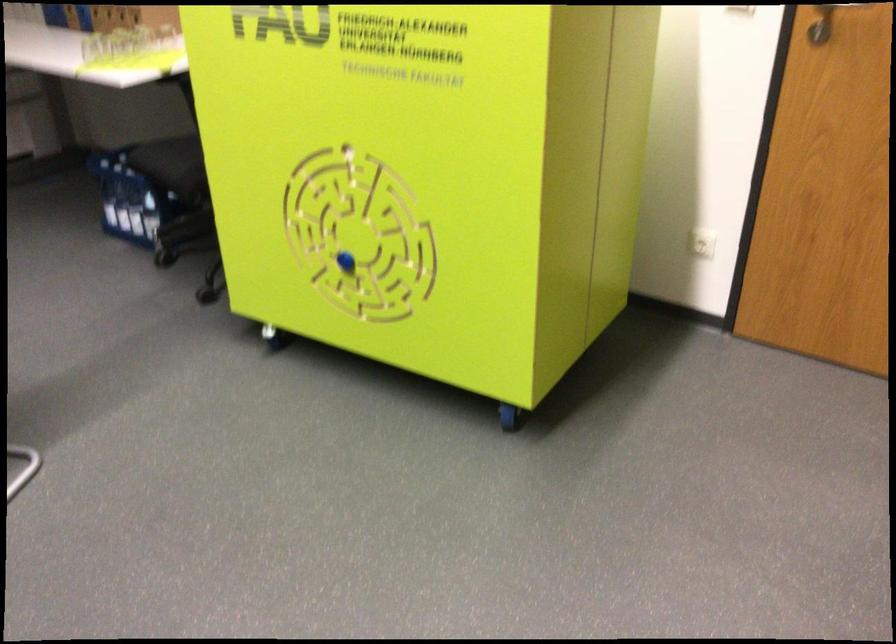
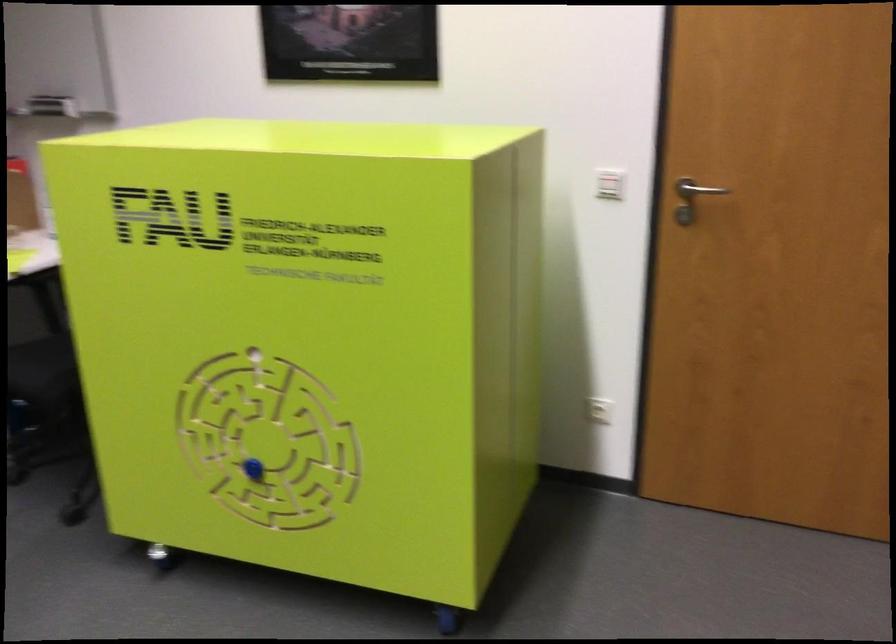
Question: I am providing you with two images of the same scene from different viewpoints. Please identify which objects are invisible in image2.

Choices:
 (A) blue maze knob
 (B) green box
 (C) white light switch
 (D) none of these

Answer: (D)